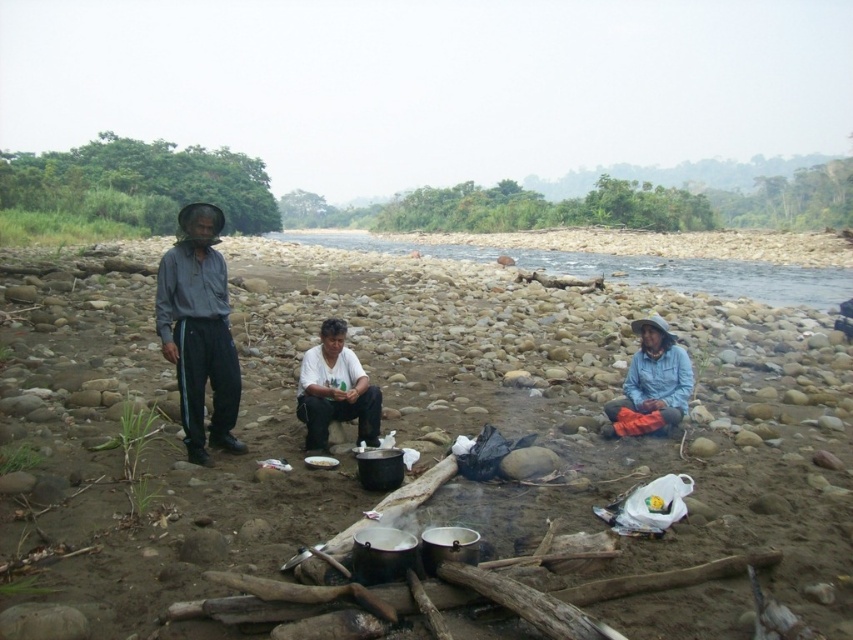
You are standing at the viewer position and want to hand a small item to the person wearing the gray fabric shirt at left. If you can throw the item up to 6 meters, will you be able to reach them?

The gray fabric shirt at left and viewer are 5.95 meters apart from each other, so yes, you can reach them by throwing the item since the distance is within your 6 meters range.

You are planning to place a small picnic basket on the ground near the white matte shirt at center. Considering the rocky riverbank described, where would be the safest spot to place it to avoid unstable stones?

The safest spot would be on a larger, more rounded stone or a stable area between the stones near the white matte shirt at center to ensure the basket remains steady.

You are standing on the rocky riverbank and want to place a small basket between the gray fabric shirt at left and the white matte shirt at center. According to the scene description, where should you position the basket so it is between them?

The gray fabric shirt at left is above the white matte shirt at center, so to place the basket between them, position it below the gray fabric shirt at left and above the white matte shirt at center.